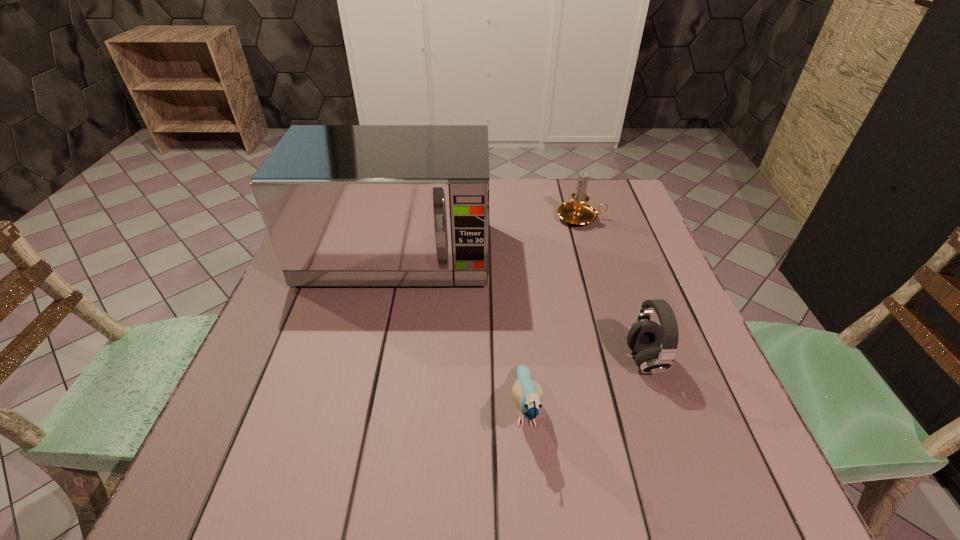
Find the location of `free space between the headset and the second object from left to right`. free space between the headset and the second object from left to right is located at coordinates (586, 384).

Identify the location of blank region between the headset and the leftmost object. (520, 308).

Locate which object ranks second in proximity to the tallest object. Please provide its 2D coordinates. Your answer should be formatted as a tuple, i.e. [(x, y)], where the tuple contains the x and y coordinates of a point satisfying the conditions above.

[(528, 394)]

This screenshot has height=540, width=960. Find the location of `the third closest object to the bird`. the third closest object to the bird is located at coordinates (578, 213).